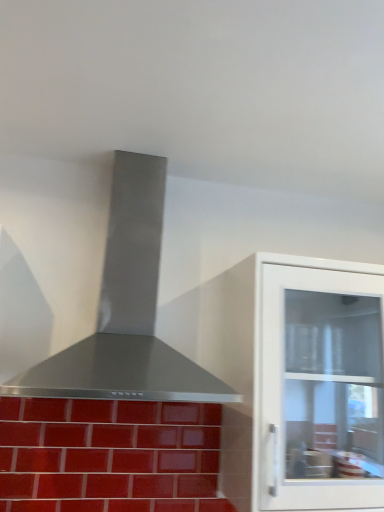
The height and width of the screenshot is (512, 384). Identify the location of white glossy cabinet at right. (301, 382).

Find the location of a particular element. This screenshot has width=384, height=512. glossy ceramic tiles at lower left is located at coordinates (109, 456).

Considering the positions of objects glossy ceramic tiles at lower left and white glossy cabinet at right in the image provided, who is more to the right, glossy ceramic tiles at lower left or white glossy cabinet at right?

white glossy cabinet at right.

Can you confirm if glossy ceramic tiles at lower left is shorter than white glossy cabinet at right?

Yes, glossy ceramic tiles at lower left is shorter than white glossy cabinet at right.

Is glossy ceramic tiles at lower left aimed at white glossy cabinet at right?

No, glossy ceramic tiles at lower left is not facing towards white glossy cabinet at right.

From the image's perspective, is glossy ceramic tiles at lower left above or below white glossy cabinet at right?

glossy ceramic tiles at lower left is below white glossy cabinet at right.

Considering their positions, is white glossy cabinet at right located in front of or behind stainless steel vent at center?

In the image, white glossy cabinet at right appears behind stainless steel vent at center.

Which is more to the left, white glossy cabinet at right or stainless steel vent at center?

stainless steel vent at center is more to the left.

From the image's perspective, is white glossy cabinet at right beneath stainless steel vent at center?

Yes, from the image's perspective, white glossy cabinet at right is beneath stainless steel vent at center.

From the image's perspective, which is above, glossy ceramic tiles at lower left or stainless steel vent at center?

stainless steel vent at center is shown above in the image.

From a real-world perspective, who is located higher, glossy ceramic tiles at lower left or stainless steel vent at center?

In real-world perspective, stainless steel vent at center is above.

Does glossy ceramic tiles at lower left contain stainless steel vent at center?

No.

Considering the relative positions of glossy ceramic tiles at lower left and stainless steel vent at center in the image provided, is glossy ceramic tiles at lower left behind stainless steel vent at center?

Yes, glossy ceramic tiles at lower left is further from the viewer.

Considering the sizes of objects stainless steel vent at center and white glossy cabinet at right in the image provided, who is thinner, stainless steel vent at center or white glossy cabinet at right?

white glossy cabinet at right is thinner.

From a real-world perspective, is stainless steel vent at center on white glossy cabinet at right?

Yes, from a real-world perspective, stainless steel vent at center is on top of white glossy cabinet at right.

Considering the points (102, 312) and (58, 423), which point is in front, point (102, 312) or point (58, 423)?

The point (102, 312) is closer.

Would you say glossy ceramic tiles at lower left is part of stainless steel vent at center's contents?

Definitely not — glossy ceramic tiles at lower left is not inside stainless steel vent at center.

Where is `vent to the left of glossy ceramic tiles at lower left`? This screenshot has height=512, width=384. vent to the left of glossy ceramic tiles at lower left is located at coordinates [126, 310].

Considering the sizes of objects stainless steel vent at center and glossy ceramic tiles at lower left in the image provided, who is thinner, stainless steel vent at center or glossy ceramic tiles at lower left?

With smaller width is glossy ceramic tiles at lower left.

Considering the relative sizes of white glossy cabinet at right and glossy ceramic tiles at lower left in the image provided, is white glossy cabinet at right shorter than glossy ceramic tiles at lower left?

In fact, white glossy cabinet at right may be taller than glossy ceramic tiles at lower left.

Is point (246, 432) closer to viewer compared to point (162, 458)?

Yes, point (246, 432) is in front of point (162, 458).

Is white glossy cabinet at right to the left or to the right of glossy ceramic tiles at lower left in the image?

Based on their positions, white glossy cabinet at right is located to the right of glossy ceramic tiles at lower left.

In order to click on brickwork below the white glossy cabinet at right (from the image's perspective) in this screenshot , I will do `click(109, 456)`.

This screenshot has height=512, width=384. Find the location of `cabinetry that is behind the stainless steel vent at center`. cabinetry that is behind the stainless steel vent at center is located at coordinates (301, 382).

Which object lies nearer to the anchor point stainless steel vent at center, glossy ceramic tiles at lower left or white glossy cabinet at right?

glossy ceramic tiles at lower left lies closer to stainless steel vent at center than the other object.

Which object lies nearer to the anchor point stainless steel vent at center, white glossy cabinet at right or glossy ceramic tiles at lower left?

Based on the image, glossy ceramic tiles at lower left appears to be nearer to stainless steel vent at center.

From the image, which object appears to be farther from white glossy cabinet at right, stainless steel vent at center or glossy ceramic tiles at lower left?

The object further to white glossy cabinet at right is stainless steel vent at center.

Which object lies nearer to the anchor point glossy ceramic tiles at lower left, white glossy cabinet at right or stainless steel vent at center?

Among the two, white glossy cabinet at right is located nearer to glossy ceramic tiles at lower left.

Considering their positions, is stainless steel vent at center positioned further to glossy ceramic tiles at lower left than white glossy cabinet at right?

The object further to glossy ceramic tiles at lower left is stainless steel vent at center.

Looking at the image, which one is located further to white glossy cabinet at right, glossy ceramic tiles at lower left or stainless steel vent at center?

Among the two, stainless steel vent at center is located further to white glossy cabinet at right.

This screenshot has height=512, width=384. Identify the location of brickwork between stainless steel vent at center and white glossy cabinet at right in the horizontal direction. (109, 456).